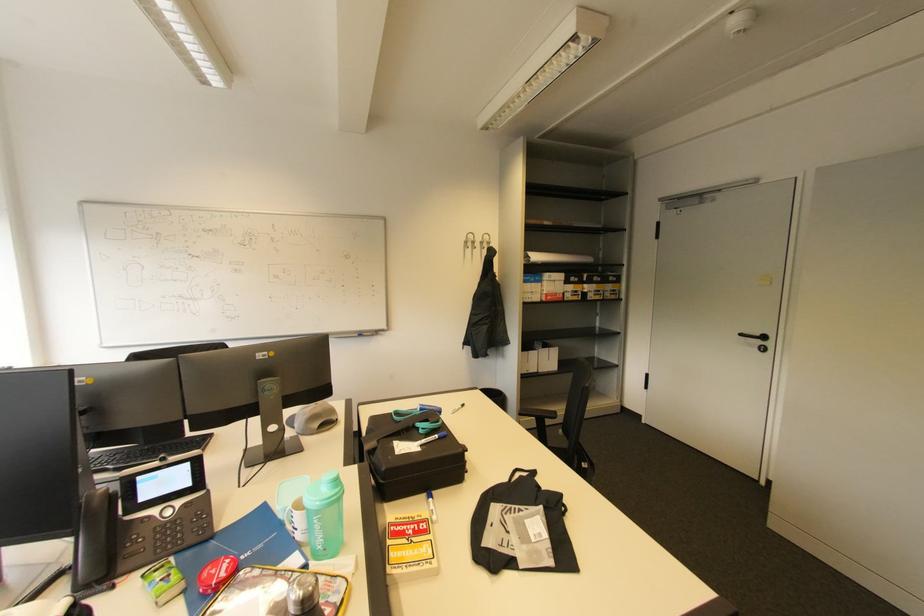
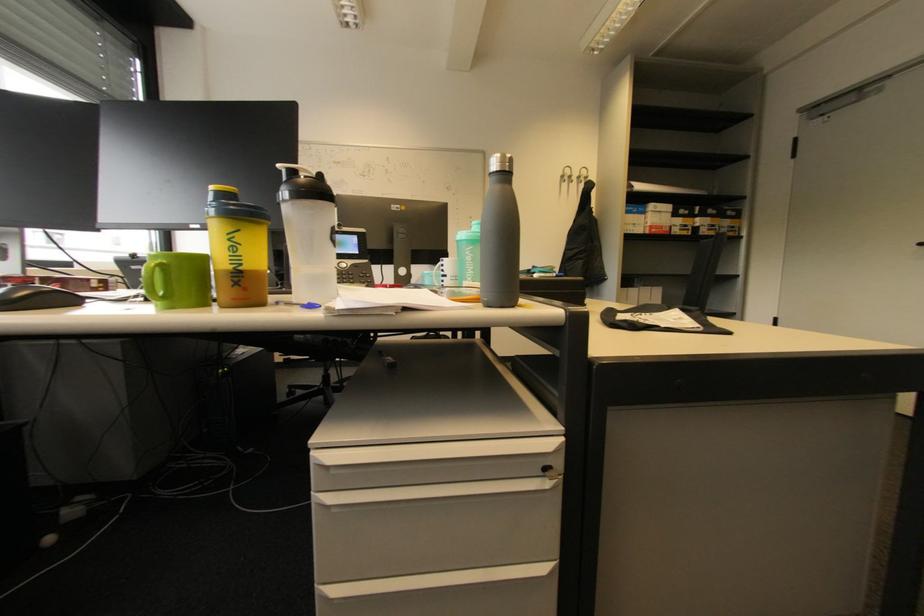
Question: The first image is from the beginning of the video and the second image is from the end. How did the camera likely rotate when shooting the video?

Choices:
 (A) Left
 (B) Right
 (C) Up
 (D) Down

Answer: (A)